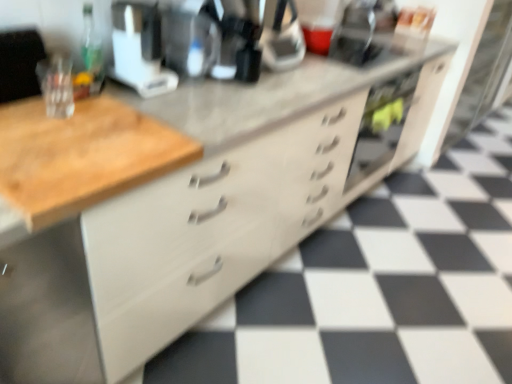
You are a GUI agent. You are given a task and a screenshot of the screen. Output one action in this format:
    pyautogui.click(x=<x>, y=<y>)
    Task: Click on the vacant area that lies between white plastic coffee maker at upper center and green glass bottle at upper left
    The image size is (512, 384).
    Given the screenshot: What is the action you would take?
    pyautogui.click(x=115, y=87)